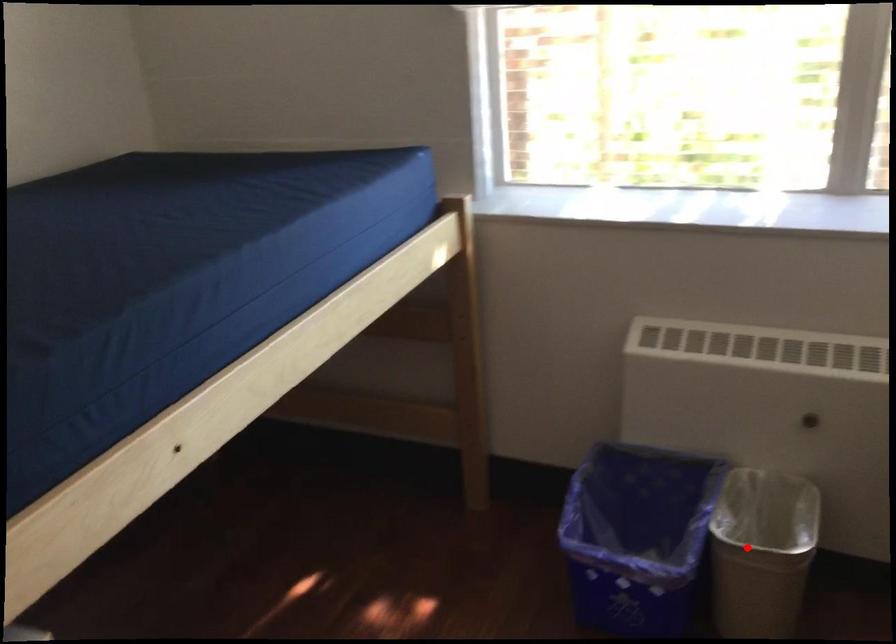
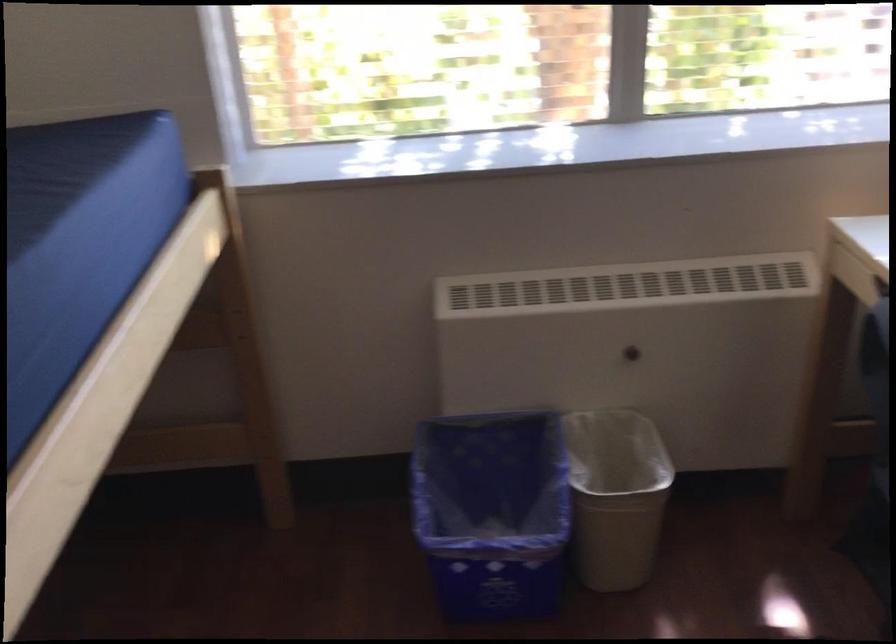
The point at the highlighted location is marked in the first image. Where is the corresponding point in the second image?

(616, 496)